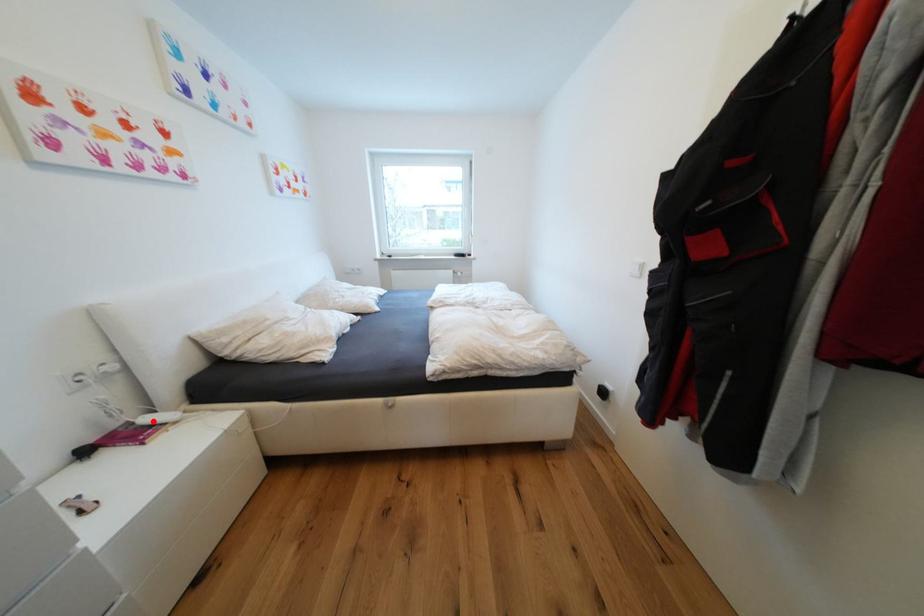
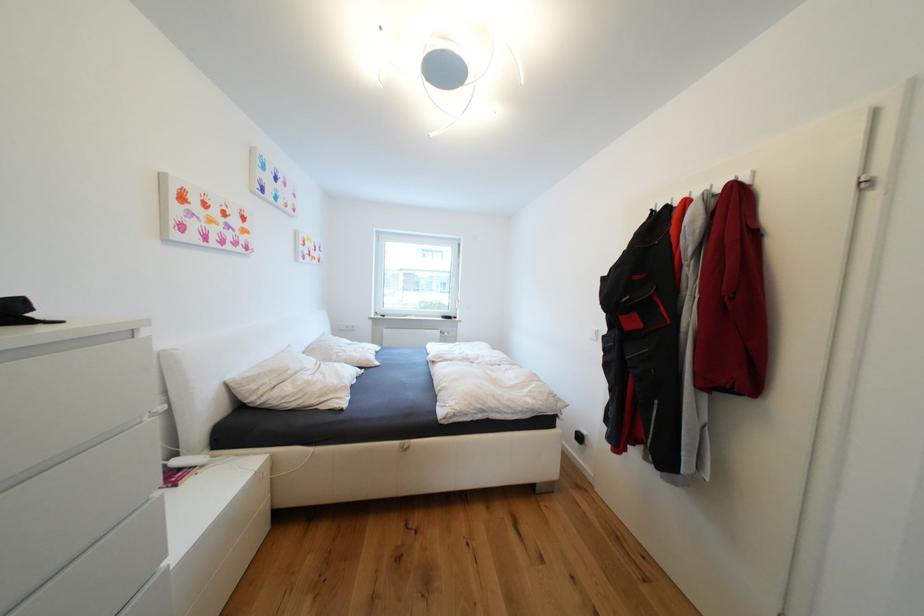
In the second image, find the point that corresponds to the highlighted location in the first image.

(184, 464)